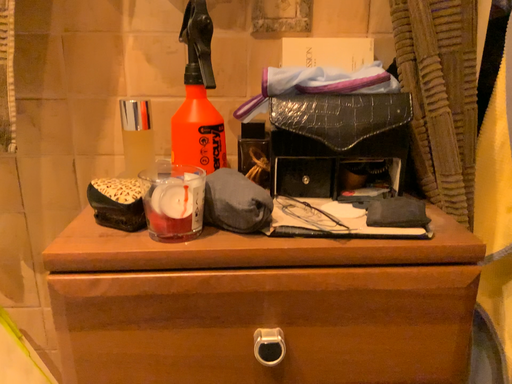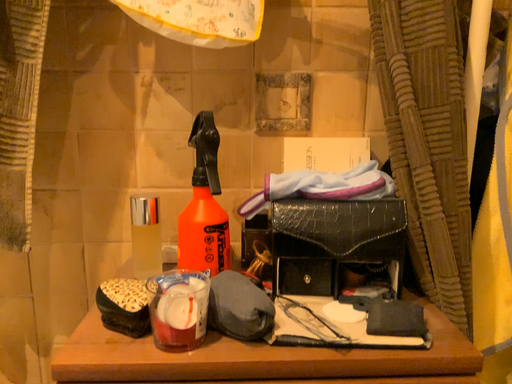
Question: How did the camera likely rotate when shooting the video?

Choices:
 (A) rotated upward
 (B) rotated downward

Answer: (A)